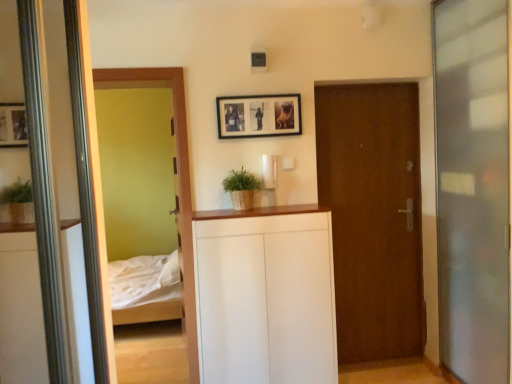
Identify the location of blank space situated above brown wooden door at center (from a real-world perspective). (367, 86).